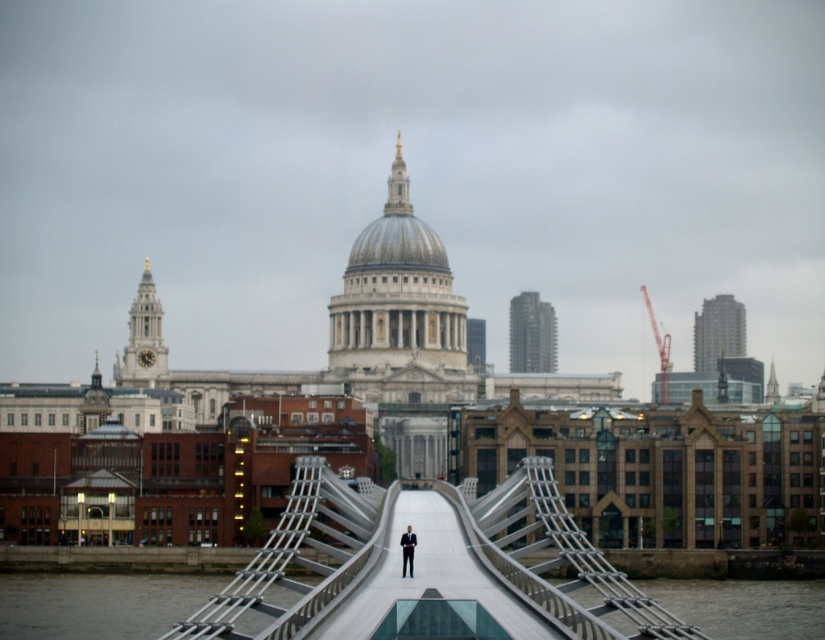
You are standing at the point labeled as point (x=356, y=612) on the Millennium Bridge in London. You want to walk to the base of St. Pauls Cathedral, which is directly behind you. How far will you have to walk to reach the base of the cathedral?

The point (x=356, y=612) is 76.30 meters away from the viewer. Since the base of St. Pauls Cathedral is directly behind you, you would need to walk 76.30 meters backward to reach it.

You are standing at the center of the smooth concrete bridge at center. Looking towards St. Pauls Cathedral in the background, which direction should you walk to reach the cathedral?

Since St. Pauls Cathedral is in the background, you should walk towards the direction away from the smooth concrete bridge at center to reach it.